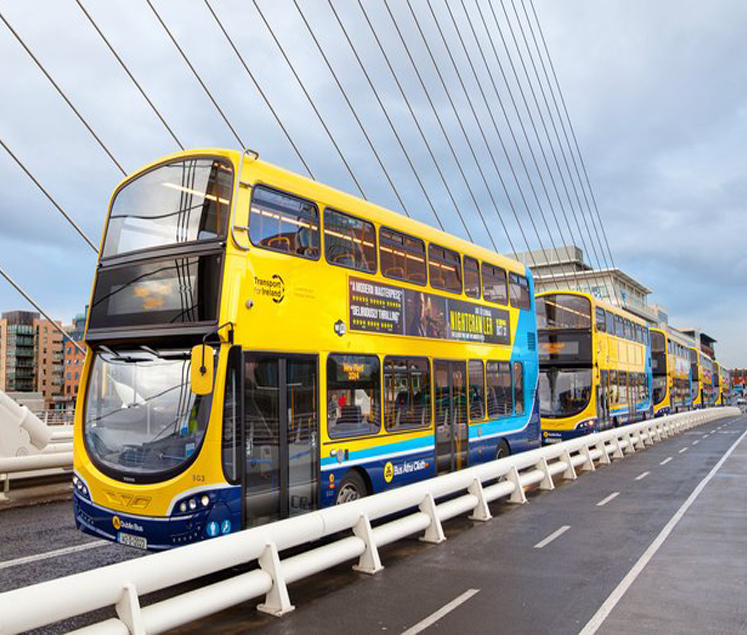
The height and width of the screenshot is (635, 747). I want to click on screen, so click(x=148, y=296), click(x=356, y=375), click(x=561, y=351).